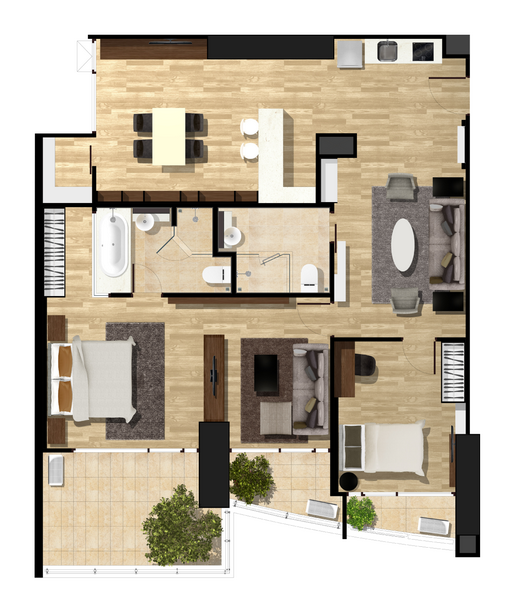
What are the coordinates of `sofa` in the screenshot? It's located at (448, 251).